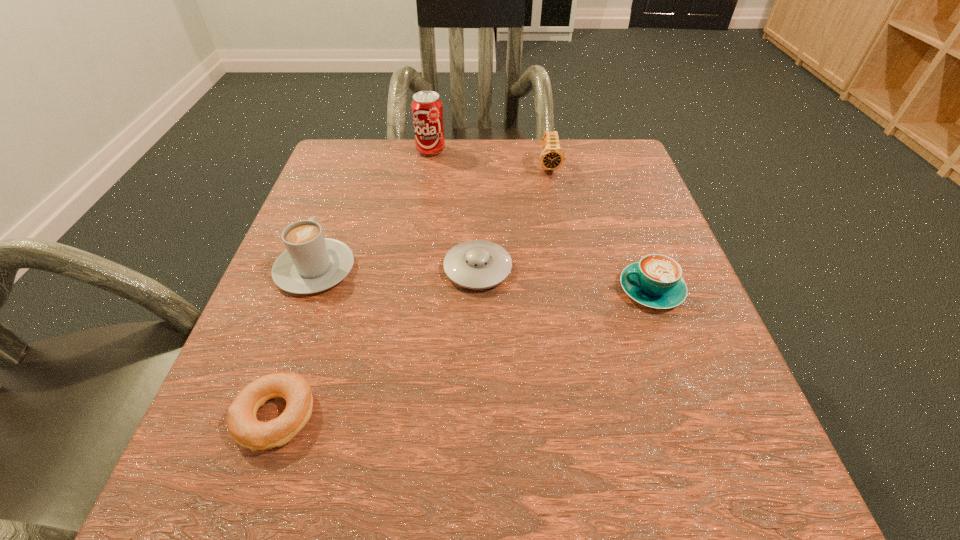
The image size is (960, 540). I want to click on free space located 0.110m to the right of the taller cappuccino, so click(338, 207).

I want to click on free space located to the right of the taller cappuccino, so click(349, 175).

Find the location of a particular element. The width and height of the screenshot is (960, 540). free location located on the face of the fifth object from left to right is located at coordinates (559, 216).

Locate an element on the screen. This screenshot has width=960, height=540. vacant position located with the handle on the right side of the shorter cappuccino is located at coordinates (584, 289).

You are a GUI agent. You are given a task and a screenshot of the screen. Output one action in this format:
    pyautogui.click(x=<x>, y=<y>)
    Task: Click on the vacant space situated with the handle on the right side of the shorter cappuccino
    The height and width of the screenshot is (540, 960).
    Given the screenshot: What is the action you would take?
    pyautogui.click(x=466, y=289)

The width and height of the screenshot is (960, 540). I want to click on vacant position located 0.370m with the handle on the right side of the shorter cappuccino, so click(401, 289).

You are a GUI agent. You are given a task and a screenshot of the screen. Output one action in this format:
    pyautogui.click(x=<x>, y=<y>)
    Task: Click on the vacant space located on the front of the saucer
    This screenshot has width=960, height=540.
    Given the screenshot: What is the action you would take?
    pyautogui.click(x=476, y=496)

What are the coordinates of `free location located 0.220m on the right of the nearest object` in the screenshot? It's located at (479, 417).

Where is `soda that is at the far edge`? The height and width of the screenshot is (540, 960). soda that is at the far edge is located at coordinates (427, 111).

Locate an element on the screen. The width and height of the screenshot is (960, 540). watch that is at the far edge is located at coordinates (552, 157).